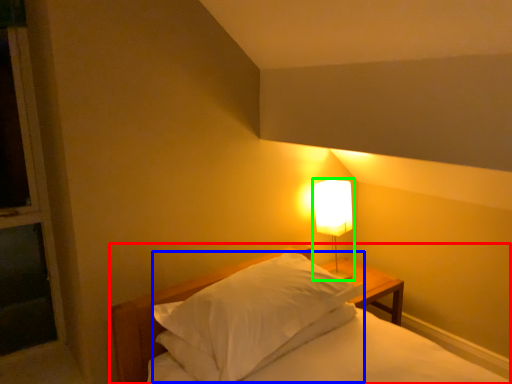
Question: Which is nearer to the bed (highlighted by a red box)? pillow (highlighted by a blue box) or lamp (highlighted by a green box).

Choices:
 (A) pillow
 (B) lamp

Answer: (A)